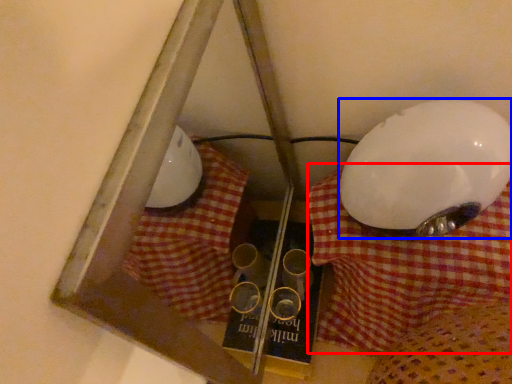
Question: Which of the following is the closest to the observer, tablecloth (highlighted by a red box) or lamp (highlighted by a blue box)?

Choices:
 (A) tablecloth
 (B) lamp

Answer: (B)